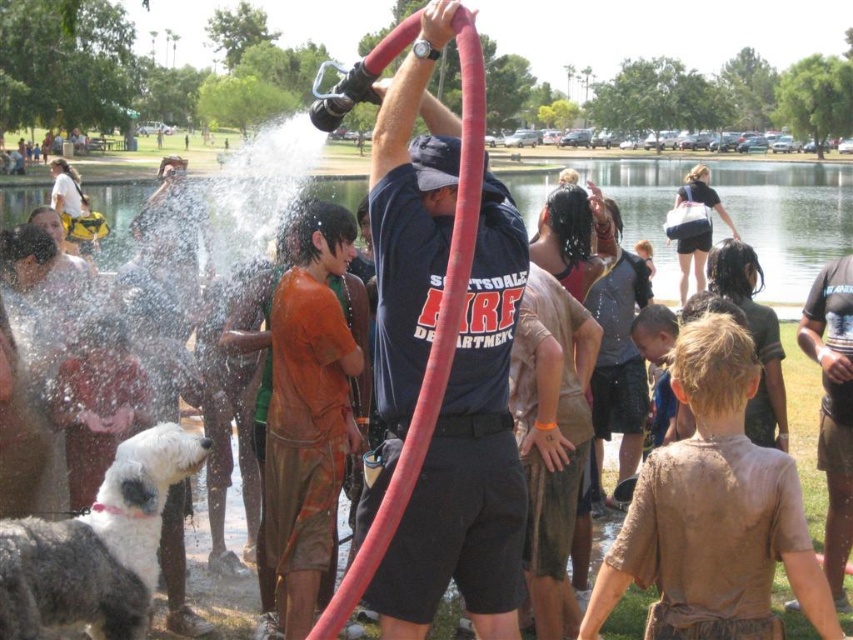
You are a photographer standing at the edge of the park. You want to capture a photo of the white foam water at center and the rubber hose at center. According to the scene description, which object is located to the right of the other?

The white foam water at center is positioned on the right side of rubber hose at center, so the white foam water at center is to the right of the rubber hose at center.

You are a photographer standing at the camera position. You want to capture a closeup shot of the rubber hose at center. Given that your camera can focus up to 7 meters, will you be able to take the photo without moving closer?

The distance of rubber hose at center from camera is 7.72 meters, which is beyond the camera focus limit of 7 meters. Therefore, you cannot take the photo without moving closer.

You are a photographer trying to capture the scene with a wide angle lens. You notice the white foam water at center and the rubber hose at center. Which object should you focus on if you want to emphasize something wider in your photo?

You should focus on the white foam water at center because its width is larger than the rubber hose at center, making it a better subject for emphasizing width in the photo.